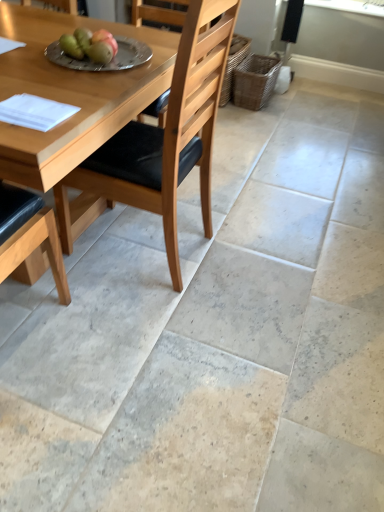
Identify the location of spots to the right of silver metallic plate at upper center. (150, 58).